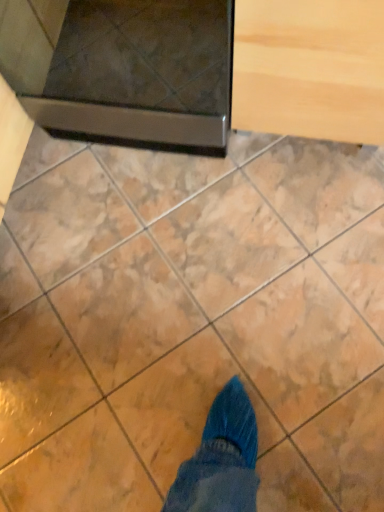
Question: Is light wood drawer at upper right not inside metallic dark gray oven at upper left?

Choices:
 (A) no
 (B) yes

Answer: (B)

Question: From a real-world perspective, is light wood drawer at upper right under metallic dark gray oven at upper left?

Choices:
 (A) yes
 (B) no

Answer: (A)

Question: Does light wood drawer at upper right have a greater width compared to metallic dark gray oven at upper left?

Choices:
 (A) yes
 (B) no

Answer: (B)

Question: Is light wood drawer at upper right bigger than metallic dark gray oven at upper left?

Choices:
 (A) no
 (B) yes

Answer: (A)

Question: Can you confirm if light wood drawer at upper right is positioned to the right of metallic dark gray oven at upper left?

Choices:
 (A) no
 (B) yes

Answer: (B)

Question: Is the position of light wood drawer at upper right more distant than that of metallic dark gray oven at upper left?

Choices:
 (A) yes
 (B) no

Answer: (B)

Question: Is marble at upper center at the right side of metallic dark gray oven at upper left?

Choices:
 (A) no
 (B) yes

Answer: (B)

Question: Is marble at upper center wider than metallic dark gray oven at upper left?

Choices:
 (A) no
 (B) yes

Answer: (B)

Question: From a real-world perspective, does marble at upper center stand above metallic dark gray oven at upper left?

Choices:
 (A) no
 (B) yes

Answer: (A)

Question: Does marble at upper center come in front of metallic dark gray oven at upper left?

Choices:
 (A) no
 (B) yes

Answer: (A)

Question: Is marble at upper center thinner than metallic dark gray oven at upper left?

Choices:
 (A) no
 (B) yes

Answer: (A)

Question: Considering the relative sizes of marble at upper center and metallic dark gray oven at upper left in the image provided, is marble at upper center smaller than metallic dark gray oven at upper left?

Choices:
 (A) no
 (B) yes

Answer: (B)

Question: Is metallic dark gray oven at upper left oriented towards light wood drawer at upper right?

Choices:
 (A) no
 (B) yes

Answer: (A)